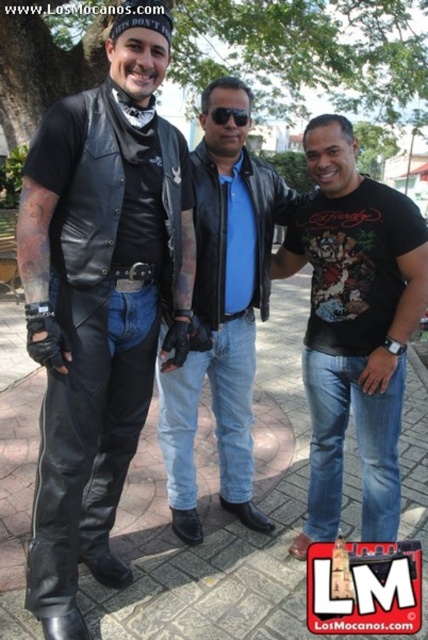
What is the color of the clothing item located at the coordinates point (353, 326)?

The clothing item at point (353, 326) is a black cotton t shirt.

You are a photographer trying to capture a closeup of the black plastic sunglasses at center without including the matte black leather pants at center in the frame. Given their relative sizes, is this possible?

The matte black leather pants at center is taller than black plastic sunglasses at center, so it is possible to capture a closeup of the black plastic sunglasses at center without including the matte black leather pants at center by focusing on the smaller object.

You are a photographer trying to capture a candid shot of the matte black leather pants at center. Your camera is currently positioned 6.72 feet away from the pants. Is the distance sufficient to ensure the pants are in focus without moving closer?

The matte black leather pants at center and camera are 6.72 feet apart. This distance may be sufficient for a focused shot depending on the camera lens and settings, but typically, for clear close details like clothing textures, being closer than 6.72 feet is recommended.